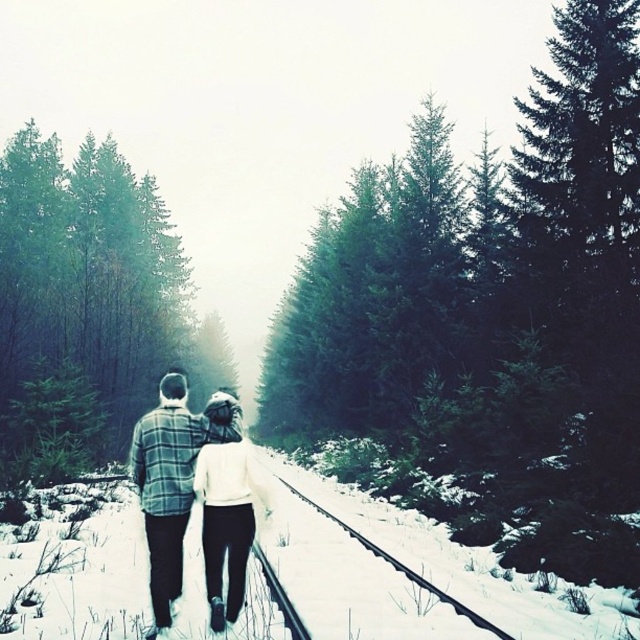
You are standing at the starting point of the railway track and see the green matte tree at center and the plaid flannel shirt at center. If you want to reach both objects, which one would you need to walk further to get to?

The green matte tree at center and plaid flannel shirt at center are 26.06 meters apart from each other, so you would need to walk further to reach whichever is farther away. However, since both are at the same central position, their distance depends on their direction from you. The description does not specify their relative directions, so it cannot be determined which requires more walking.

You are standing at the point marked by the coordinates point (492, 317) in the winter scene. What object are you currently standing on?

The point (492, 317) is on green matte tree at center, so you are standing on the green matte tree at center.

You are a photographer trying to capture a clear photo of the plaid flannel shirt at center without the green matte tree at center blocking it. Based on the scene, what adjustment can you make to your camera angle to achieve this?

The green matte tree at center is positioned over the plaid flannel shirt at center. To avoid the tree blocking the shirt, you can lower your camera angle to shoot from below the tree, allowing the shirt to be visible beneath it.